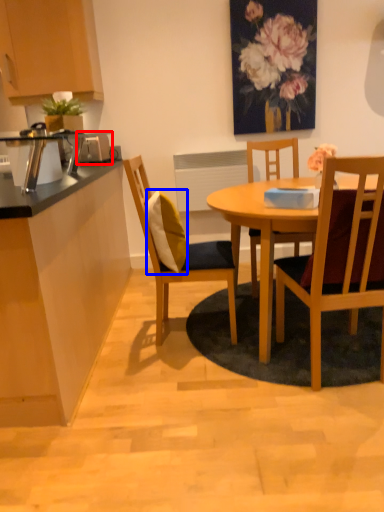
Question: Among these objects, which one is nearest to the camera, appliance (highlighted by a red box) or pillow (highlighted by a blue box)?

Choices:
 (A) appliance
 (B) pillow

Answer: (B)